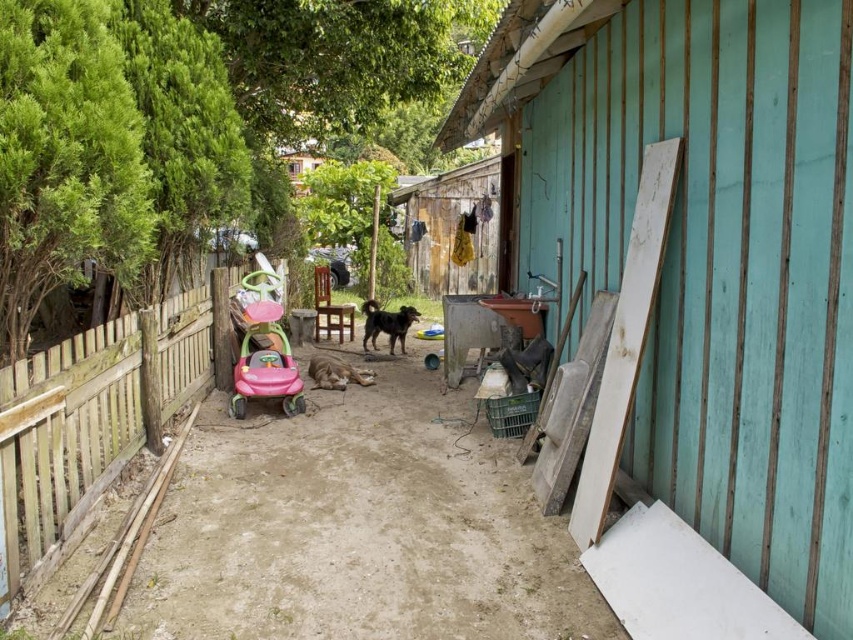
You are a parent trying to move the pink plastic baby carriage at center to the left side of the wooden boards at right. Can you fit the carriage next to the boards without overlapping them?

The wooden boards at right has a lesser width compared to pink plastic baby carriage at center. Since the carriage is wider, there might not be enough space to fit it next to the boards without overlapping. Consider moving the boards first or finding a wider area.

Consider the image. You are a delivery person standing at the edge of the yard. You need to place a package that is 3 meters long on the ground. Can you fit the package between the wooden boards at right and your current position?

The distance between the wooden boards at right and the viewer is 2.98 meters, so the package cannot be placed as it is slightly longer than the available space.